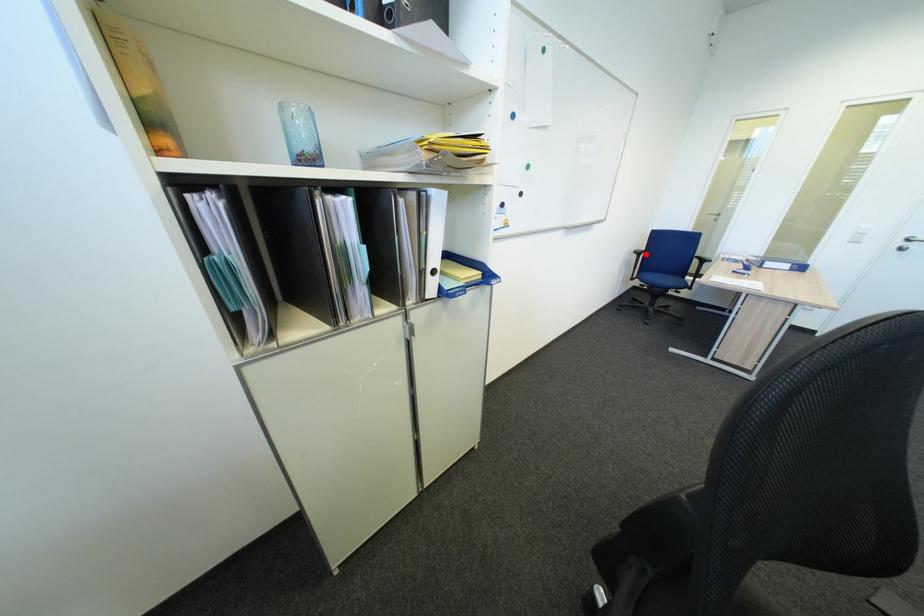
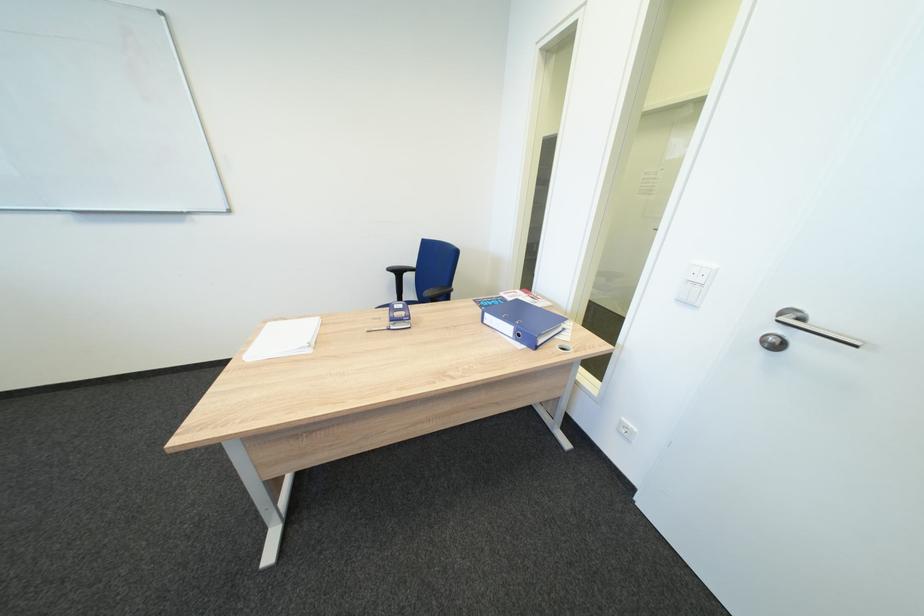
Question: A red point is marked in image1. In image2, is the corresponding 3D point closer to the camera or farther? Reply with the corresponding letter.

Choices:
 (A) The corresponding 3D point is closer.
 (B) The corresponding 3D point is farther.

Answer: (B)